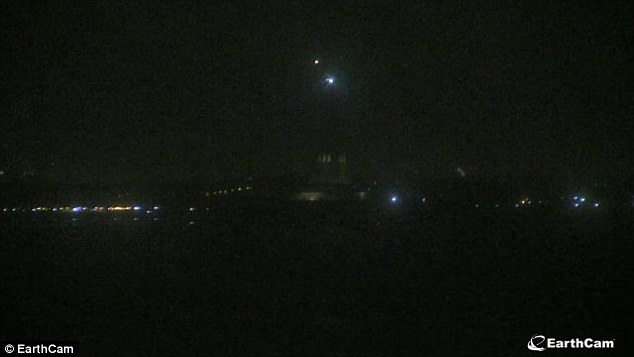
Find the location of a particular element. This screenshot has width=634, height=357. blue lights is located at coordinates (579, 200).